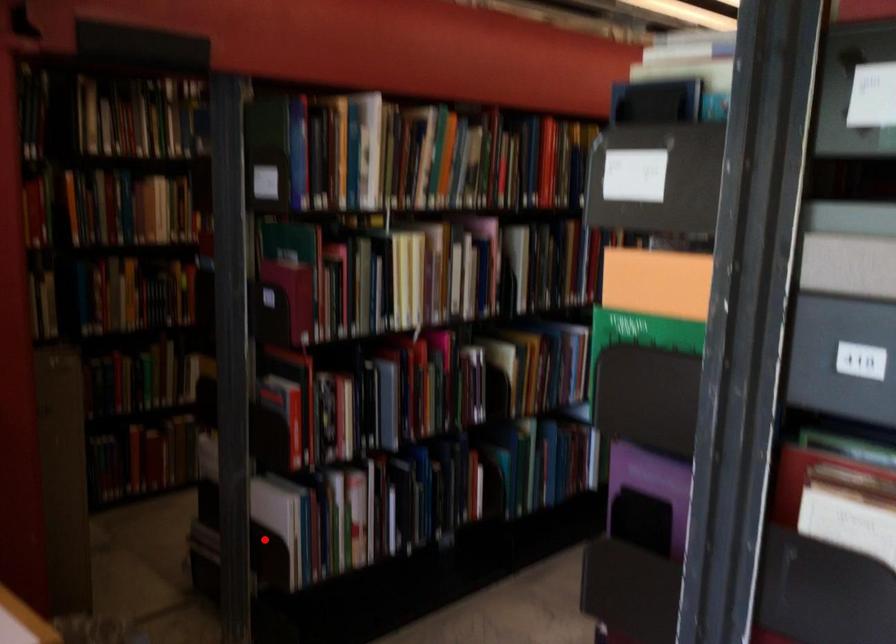
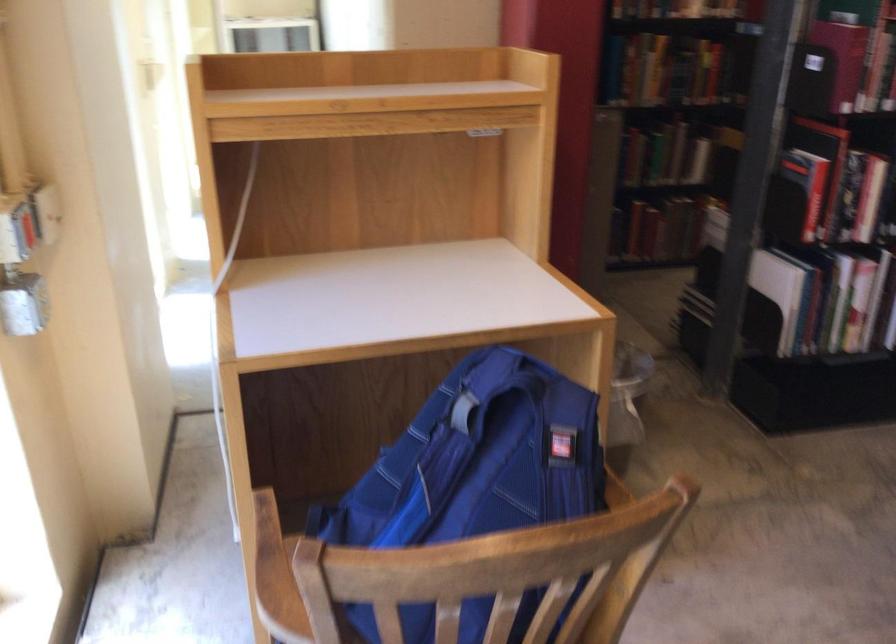
In the second image, find the point that corresponds to the highlighted location in the first image.

(777, 292)